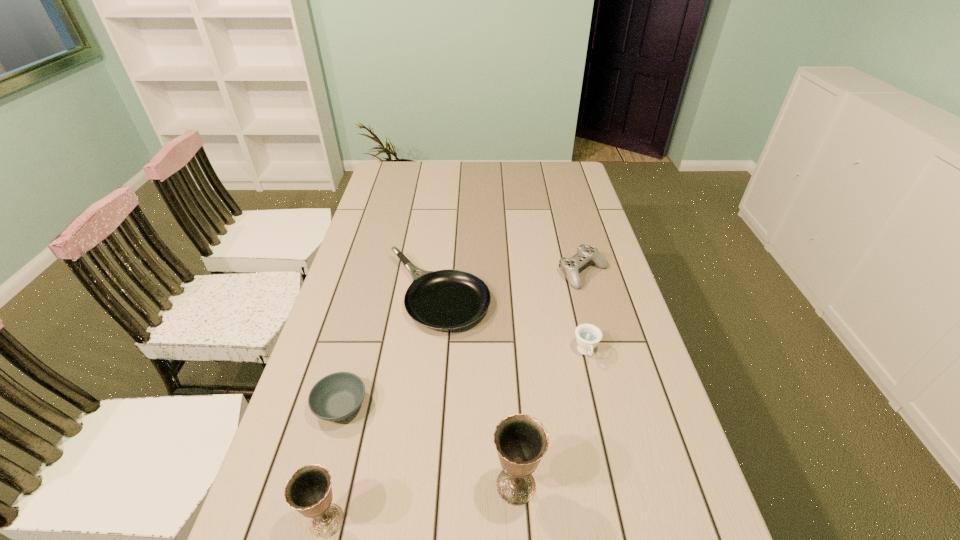
Find the location of a particular element. Image resolution: width=960 pixels, height=540 pixels. object that stands as the fifth closest to the shorter chalice is located at coordinates (569, 266).

Where is `object that is the fifth closest to the teacup`? object that is the fifth closest to the teacup is located at coordinates (308, 490).